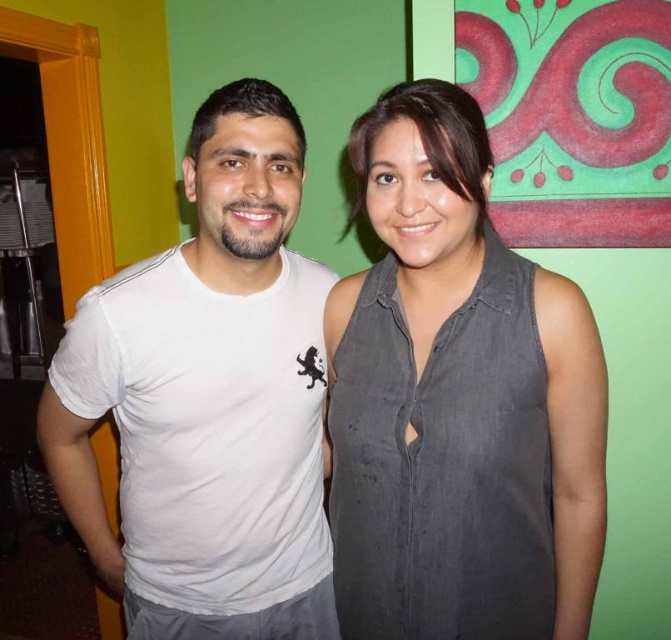
Question: Is the position of gray cotton shirt at center less distant than that of white cotton t-shirt at left?

Choices:
 (A) no
 (B) yes

Answer: (B)

Question: Is gray cotton shirt at center thinner than white cotton t-shirt at left?

Choices:
 (A) yes
 (B) no

Answer: (A)

Question: Which point is farther to the camera?

Choices:
 (A) gray cotton shirt at center
 (B) white cotton t-shirt at left

Answer: (B)

Question: Is gray cotton shirt at center to the right of white cotton t-shirt at left from the viewer's perspective?

Choices:
 (A) no
 (B) yes

Answer: (B)

Question: Which point is closer to the camera taking this photo?

Choices:
 (A) (401, 90)
 (B) (195, 388)

Answer: (A)